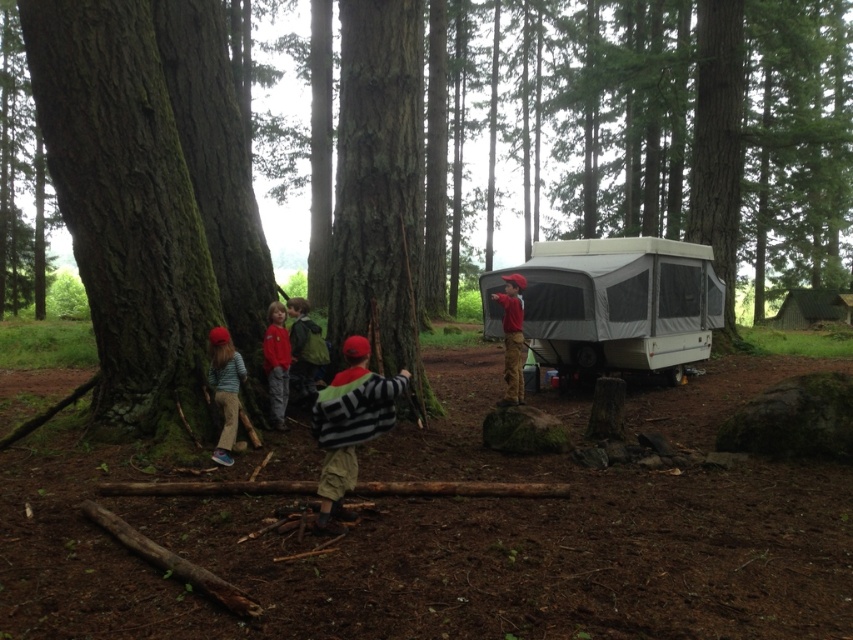
From the picture: You are a hiker who just arrived at the campsite and need to store your striped sweater at left. You want to place it somewhere safe and dry. Can you put it inside the white mesh recreational vehicle at right?

The white mesh recreational vehicle at right is above the striped sweater at left, so yes, you can place the striped sweater at left inside the white mesh recreational vehicle at right since it is positioned higher and likely accessible.

You are standing at the origin point in the forest scene. The green rough bark tree at center is located at coordinates 0.202 on the x axis and 0.807 on the y axis. If you want to walk directly towards the tree, in which direction should you move?

To reach the green rough bark tree at center located at coordinates x 0.202 and y 0.807, you should move northeast since the tree is northeast of your starting position at the origin.